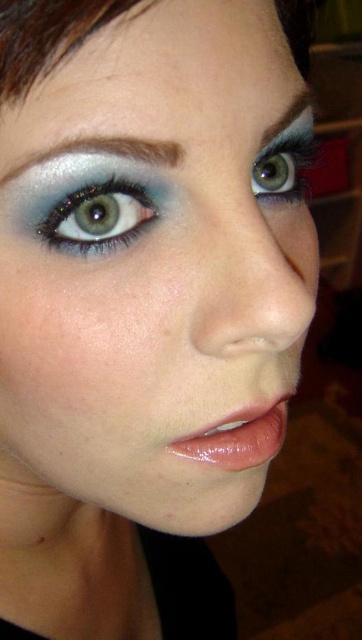
Question: Which object appears closest to the camera in this image?

Choices:
 (A) shimmering teal eye at center
 (B) smokey gray eyebrow at upper center
 (C) shiny blue eye at upper right

Answer: (A)

Question: Is glossy pink lipstick at lower center smaller than smokey gray eyebrow at upper center?

Choices:
 (A) no
 (B) yes

Answer: (B)

Question: Can you confirm if brown matte hair at upper left is smaller than glossy pink lipstick at lower center?

Choices:
 (A) no
 (B) yes

Answer: (A)

Question: Can you confirm if smokey gray eyebrow at upper left is thinner than shiny blue eye at upper right?

Choices:
 (A) no
 (B) yes

Answer: (A)

Question: Among these objects, which one is nearest to the camera?

Choices:
 (A) smokey gray eyebrow at upper left
 (B) glossy pink lipstick at lower center

Answer: (A)

Question: Which point is farther to the camera?

Choices:
 (A) shiny blue eye at upper right
 (B) brown matte hair at upper left
 (C) smokey gray eyebrow at upper center
 (D) shimmering teal eye at center

Answer: (A)